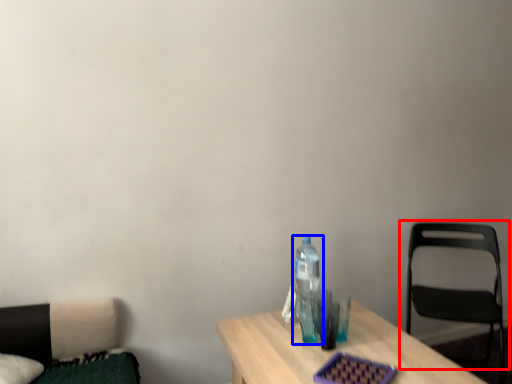
Question: Which point is further to the camera, chair (highlighted by a red box) or bottle (highlighted by a blue box)?

Choices:
 (A) chair
 (B) bottle

Answer: (A)